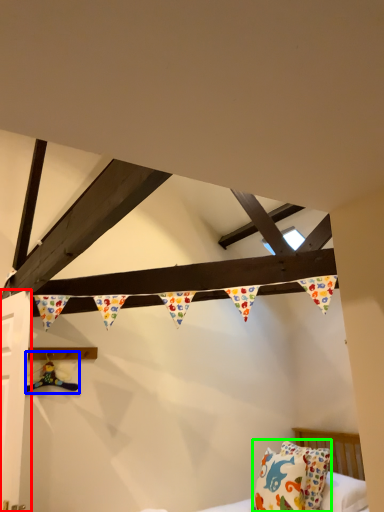
Question: Which is farther away from door (highlighted by a red box)? toy (highlighted by a blue box) or pillow (highlighted by a green box)?

Choices:
 (A) toy
 (B) pillow

Answer: (B)